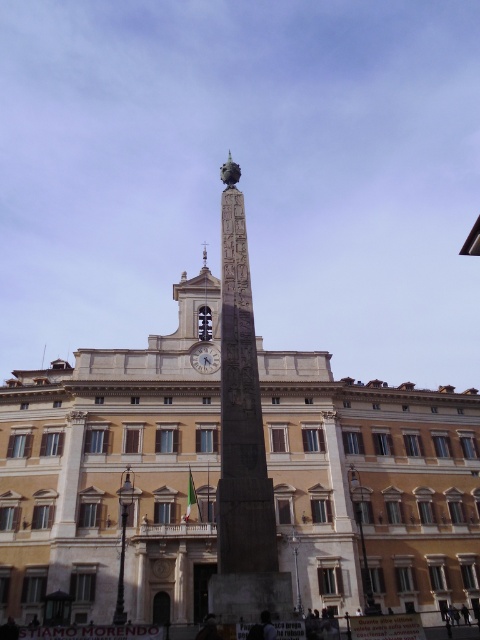
Question: Which object is closer to the camera taking this photo?

Choices:
 (A) matte silver clock at center
 (B) granite obelisk at center

Answer: (B)

Question: Is granite obelisk at center wider than matte silver clock at center?

Choices:
 (A) no
 (B) yes

Answer: (B)

Question: Is granite obelisk at center smaller than matte silver clock at center?

Choices:
 (A) no
 (B) yes

Answer: (A)

Question: Does granite obelisk at center appear under matte silver clock at center?

Choices:
 (A) no
 (B) yes

Answer: (B)

Question: Which of the following is the closest to the observer?

Choices:
 (A) (200, 364)
 (B) (290, 595)

Answer: (B)